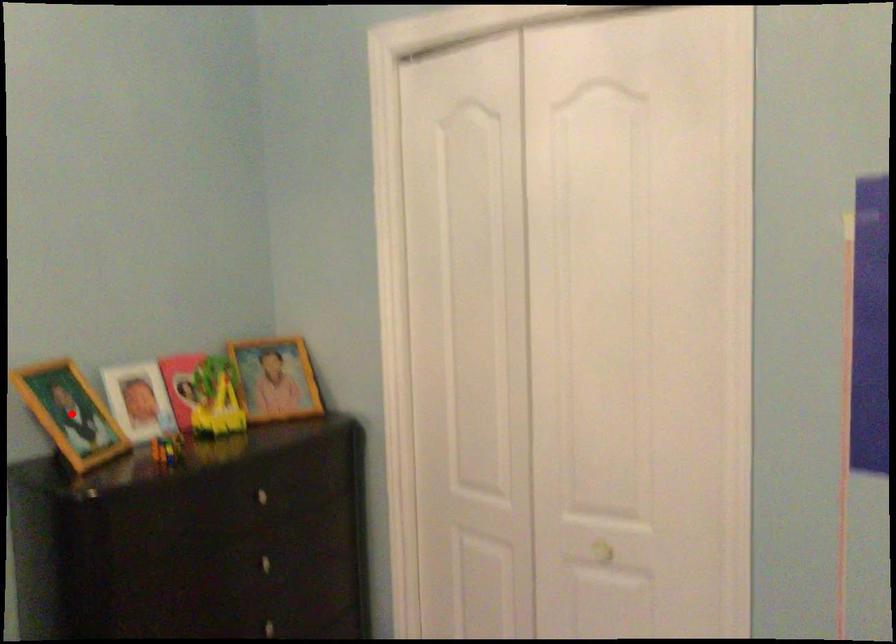
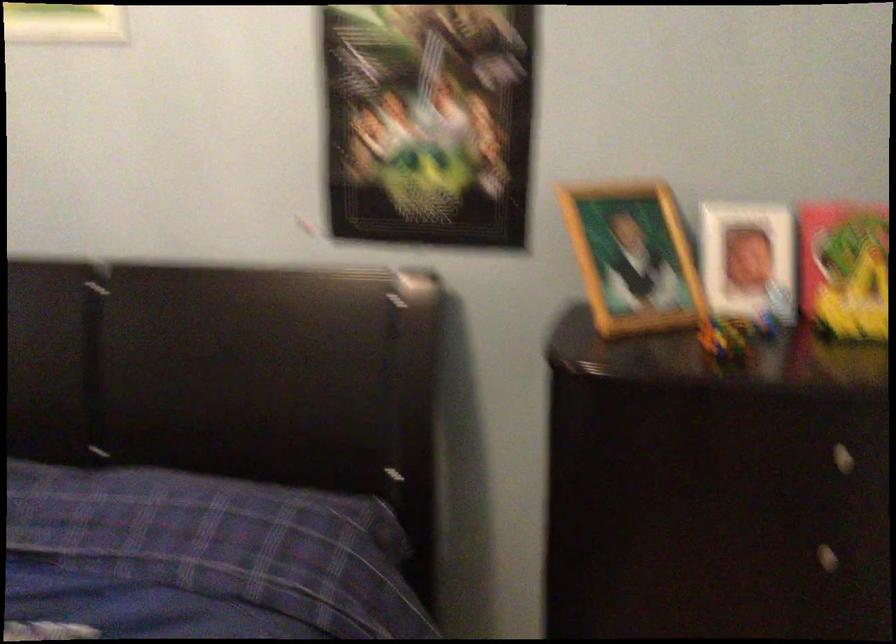
Question: I am providing you with two images of the same scene from different viewpoints. Given a red point in image1, look at the same physical point in image2. Is it:

Choices:
 (A) Closer to the viewpoint
 (B) Farther from the viewpoint

Answer: (A)